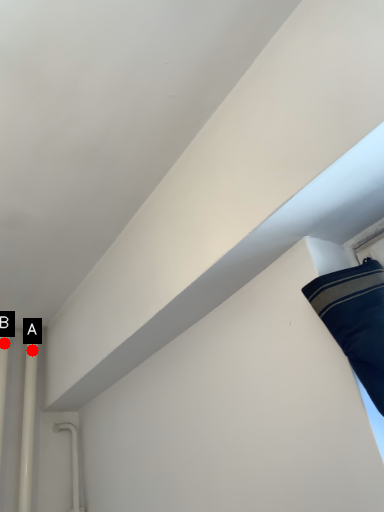
Question: Two points are circled on the image, labeled by A and B beside each circle. Which point is closer to the camera taking this photo?

Choices:
 (A) A is closer
 (B) B is closer

Answer: (B)